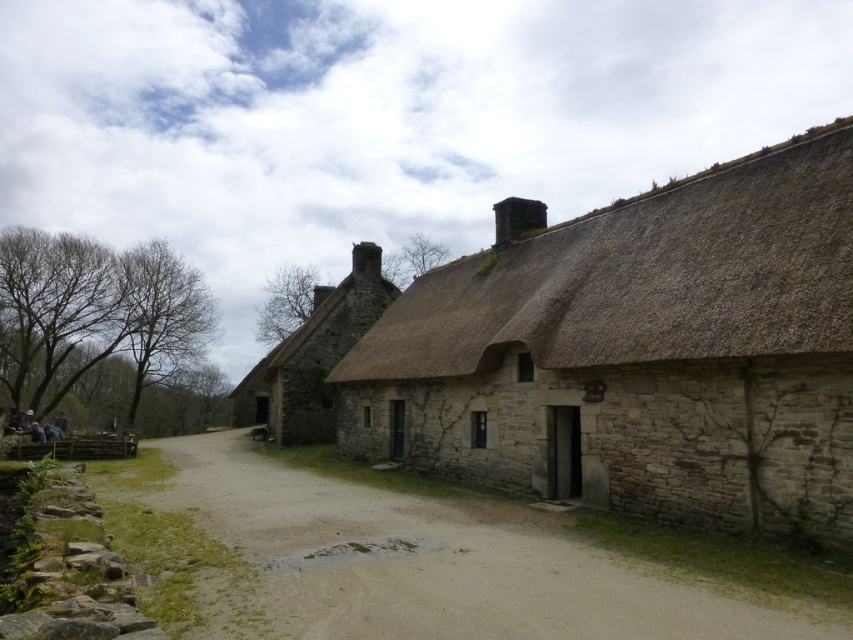
You are a delivery drone with a maximum flight range of 15 meters. You need to deliver a package to the stone thatched cottage at center from the brown thatch roof at upper right. Can you make the delivery without recharging?

The distance between the brown thatch roof at upper right and the stone thatched cottage at center is 13.60 meters, which is within your 15 meter flight range. Yes, you can make the delivery without recharging.

You are a painter standing at the front of the stone thatched cottage at center and want to paint the brown thatch roof at upper right. Do you need to climb a ladder to reach the roof?

The brown thatch roof at upper right has a lesser height compared to the stone thatched cottage at center, so you do not need to climb a ladder to reach the roof.

You are standing in front of the stone thatched cottage at center and want to look at its roof. In which direction should you turn your head to see the brown thatch roof at upper right?

You should turn your head to the right to see the brown thatch roof at upper right, as it is positioned to the right of the stone thatched cottage at center.